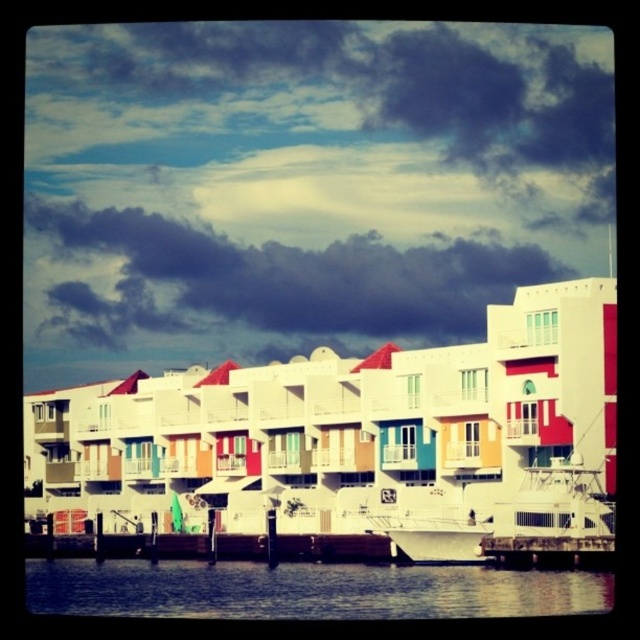
Question: Which object is positioned closest to the white glossy boat at center?

Choices:
 (A) wooden at lower center
 (B) blue water at lower center

Answer: (A)

Question: Which point appears closest to the camera in this image?

Choices:
 (A) (484, 609)
 (B) (545, 552)

Answer: (A)

Question: Can you confirm if blue water at lower center is bigger than wooden at lower center?

Choices:
 (A) yes
 (B) no

Answer: (A)

Question: Is blue water at lower center above white glossy boat at center?

Choices:
 (A) yes
 (B) no

Answer: (B)

Question: Which is nearer to the dark cloudy sky at upper center?

Choices:
 (A) wooden at lower center
 (B) white glossy boat at center

Answer: (B)

Question: Where is blue water at lower center located in relation to wooden at lower center in the image?

Choices:
 (A) below
 (B) above

Answer: (A)